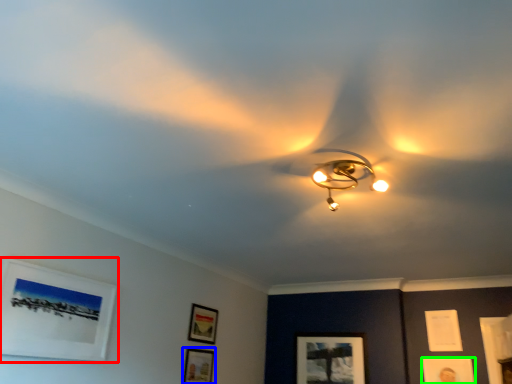
Question: Which is farther away from picture frame (highlighted by a red box)? picture frame (highlighted by a blue box) or picture frame (highlighted by a green box)?

Choices:
 (A) picture frame
 (B) picture frame

Answer: (B)